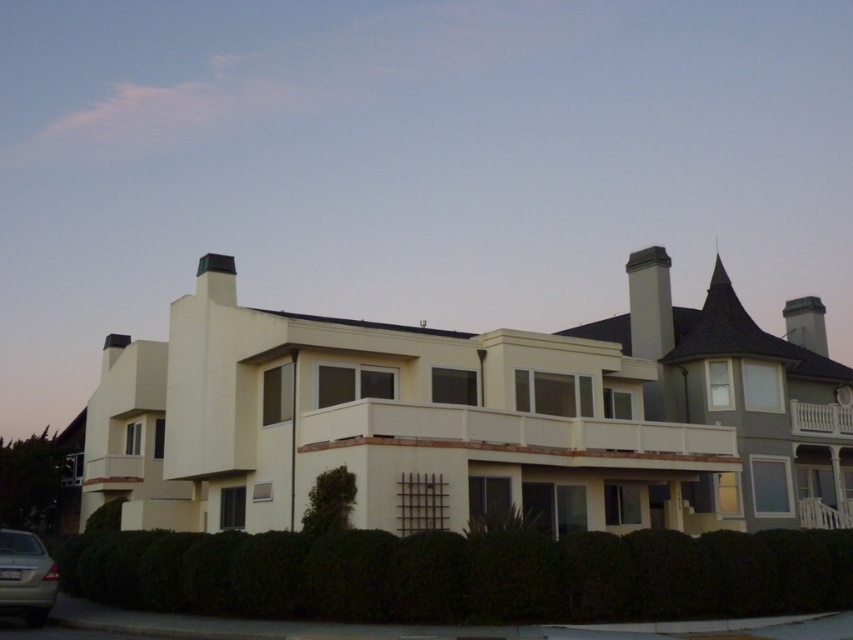
You are a delivery person trying to park your 15 feet long truck between the green leafy hedge at lower center and the silver metallic car at lower left. Is there enough space for your truck?

The distance between the green leafy hedge at lower center and the silver metallic car at lower left is 27.80 feet. Since your truck is 15 feet long, there is sufficient space to park it between them.

You are a delivery person trying to park your silver metallic car at lower left near the green leafy hedge at lower center. Since the hedge is bigger than the car, will there be enough space to park the car next to the hedge without hitting it?

The green leafy hedge at lower center has a larger size compared to the silver metallic car at lower left. Therefore, there should be sufficient space to park the silver metallic car at lower left next to the hedge without collision, as the hedge is not obstructing the parking area due to its size.

You are standing in front of the residential building and notice the green leafy hedge at lower center and the silver metallic car at lower left. Which object is closer to the ground?

The green leafy hedge at lower center is closer to the ground since it is positioned below the silver metallic car at lower left.